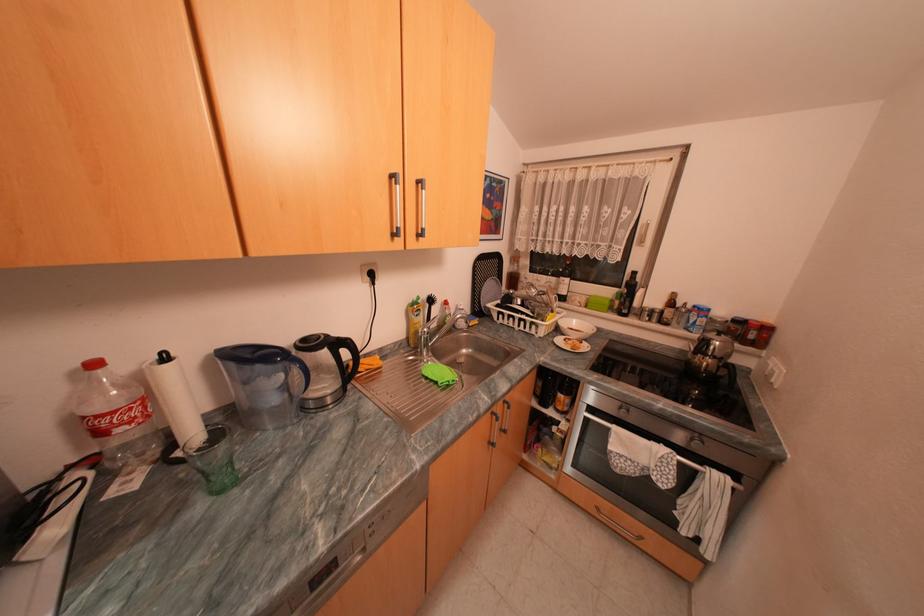
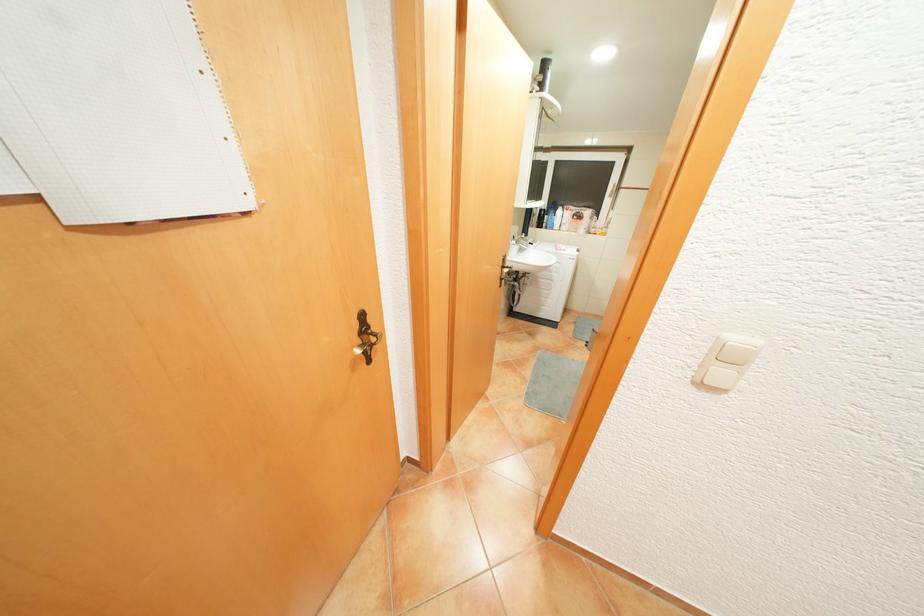
Question: In a continuous first-person perspective shot, in which direction is the camera moving?

Choices:
 (A) Left
 (B) Right
 (C) Forward
 (D) Backward

Answer: (A)